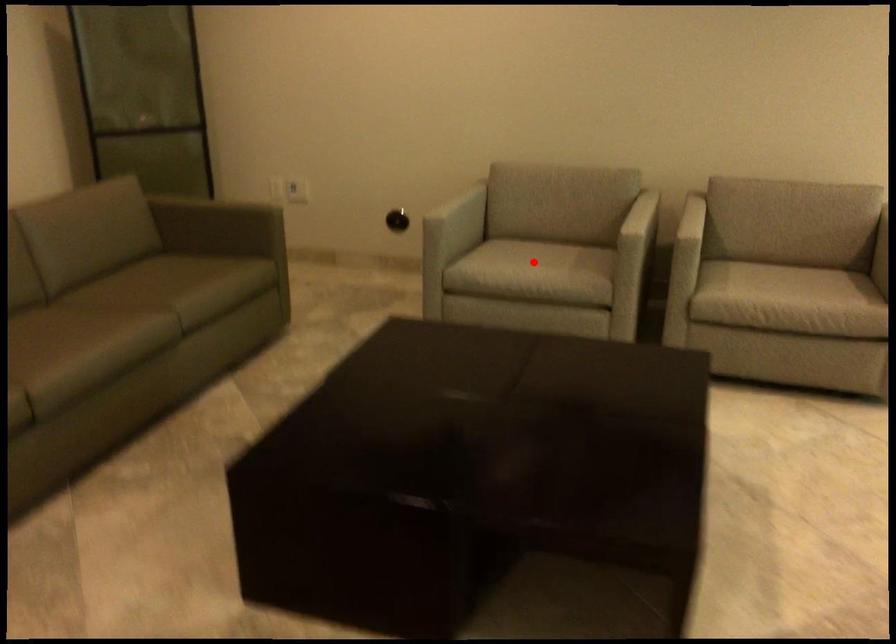
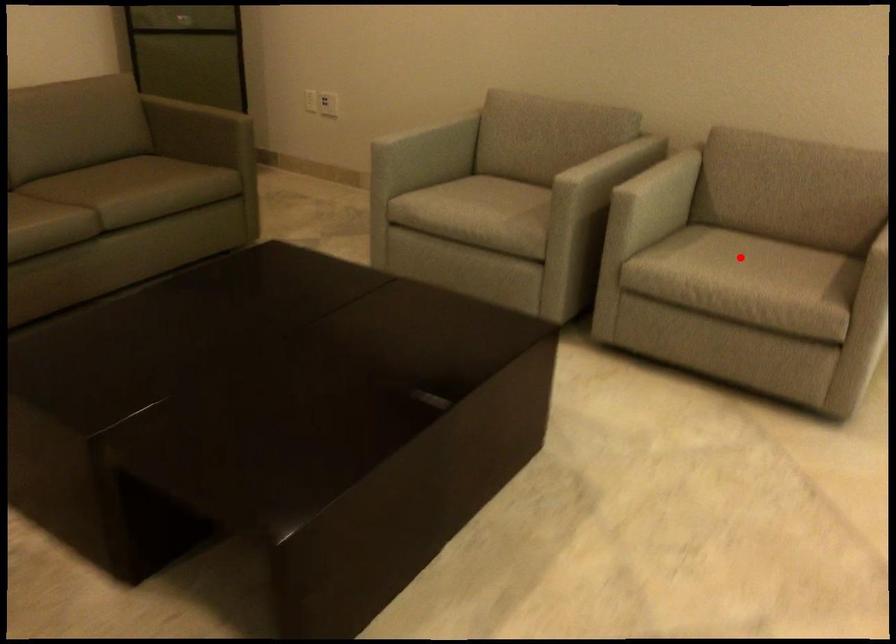
Based on the photo, I am providing you with two images of the same scene from different viewpoints. A red point is marked on the first image and another point is marked on the second image. Is the marked point in image1 the same physical position as the marked point in image2?

No